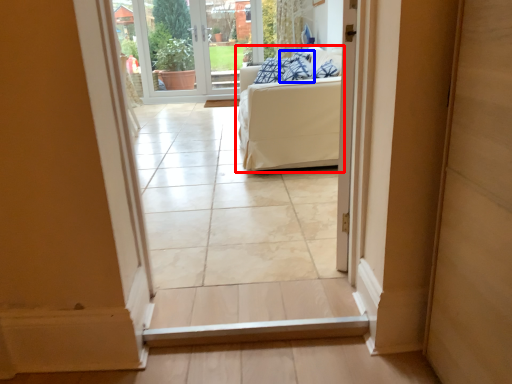
Question: Among these objects, which one is nearest to the camera, studio couch (highlighted by a red box) or pillow (highlighted by a blue box)?

Choices:
 (A) studio couch
 (B) pillow

Answer: (A)